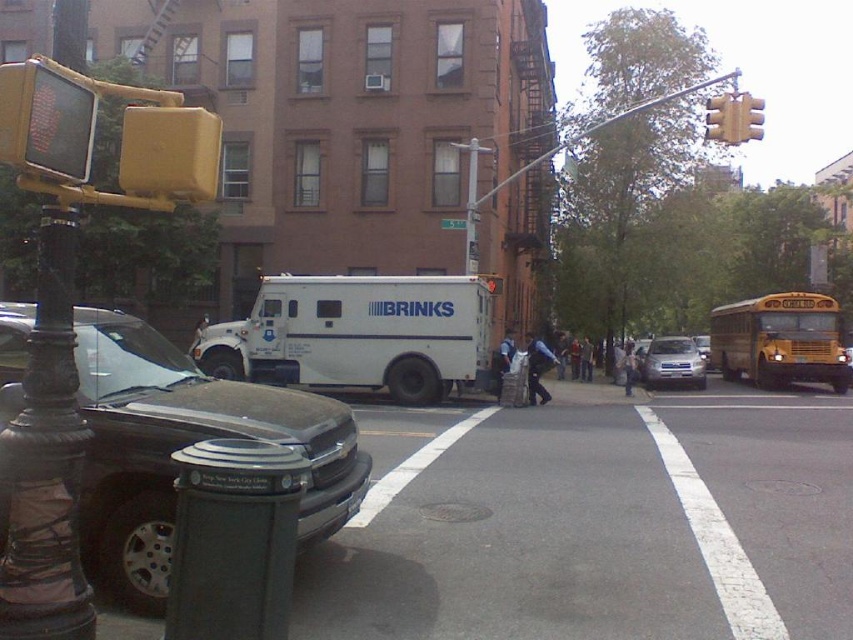
In the scene shown: You are a city planner assessing vehicle parking spaces. The white matte armored vehicle at center and the yellow metallic school bus at right are both parked in the same parking lot. Which vehicle requires a wider parking space?

The yellow metallic school bus at right requires a wider parking space because its width is greater than the white matte armored vehicle at center.

You are standing on the sidewalk across the street from the white matte armored vehicle at center. You want to take a photo of it with your phone. Considering the distance, will you need to zoom in to capture the entire vehicle in the frame?

The white matte armored vehicle at center is 63.66 feet away from you. Since most smartphones have a wide enough lens to capture objects at this distance without zooming, you can likely take the photo without zooming in.